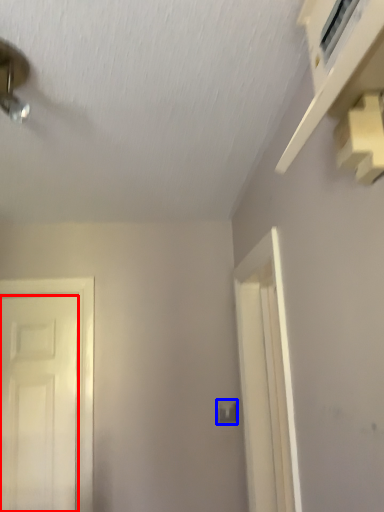
Question: Which of the following is the farthest to the observer, door (highlighted by a red box) or light switch (highlighted by a blue box)?

Choices:
 (A) door
 (B) light switch

Answer: (B)